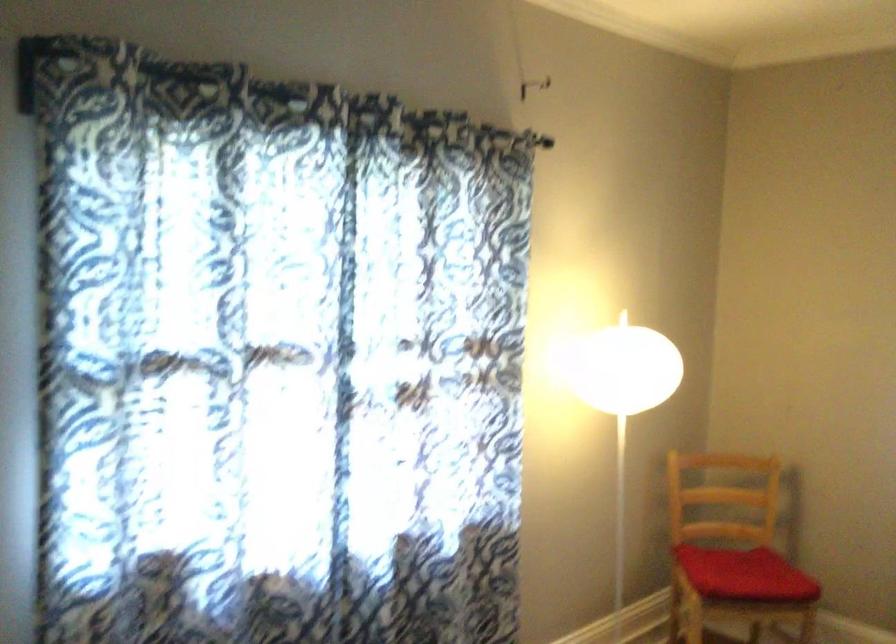
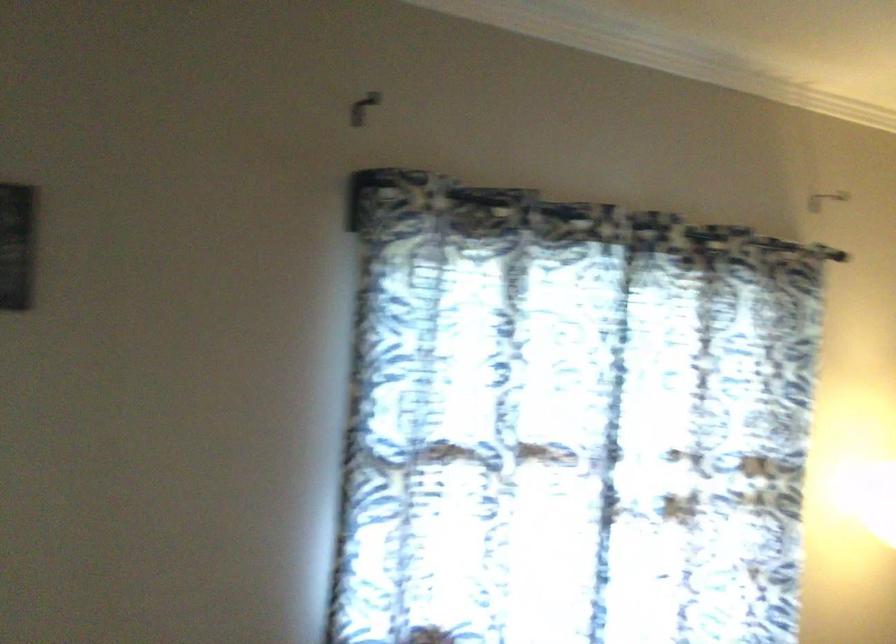
Question: The images are taken continuously from a first-person perspective. In which direction is your viewpoint rotating?

Choices:
 (A) Left
 (B) Right
 (C) Up
 (D) Down

Answer: (A)